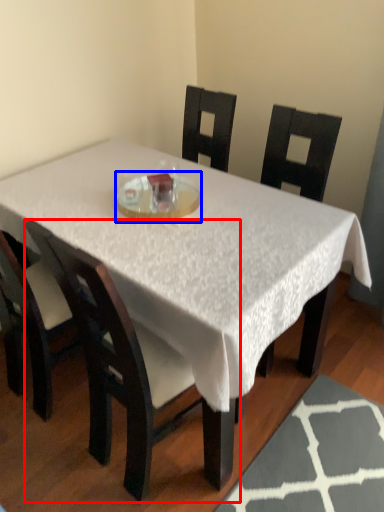
Question: Which of the following is the farthest to the observer, chair (highlighted by a red box) or glass plate (highlighted by a blue box)?

Choices:
 (A) chair
 (B) glass plate

Answer: (B)